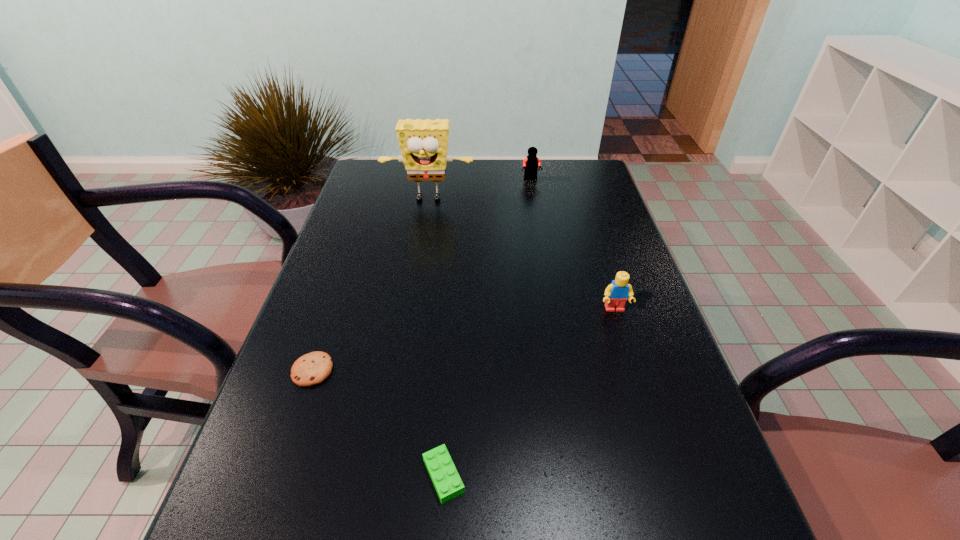
Find the location of a particular element. The image size is (960, 540). vacant area in the image that satisfies the following two spatial constraints: 1. on the front-facing side of the fourth nearest object; 2. on the left side of the leftmost Lego is located at coordinates [384, 476].